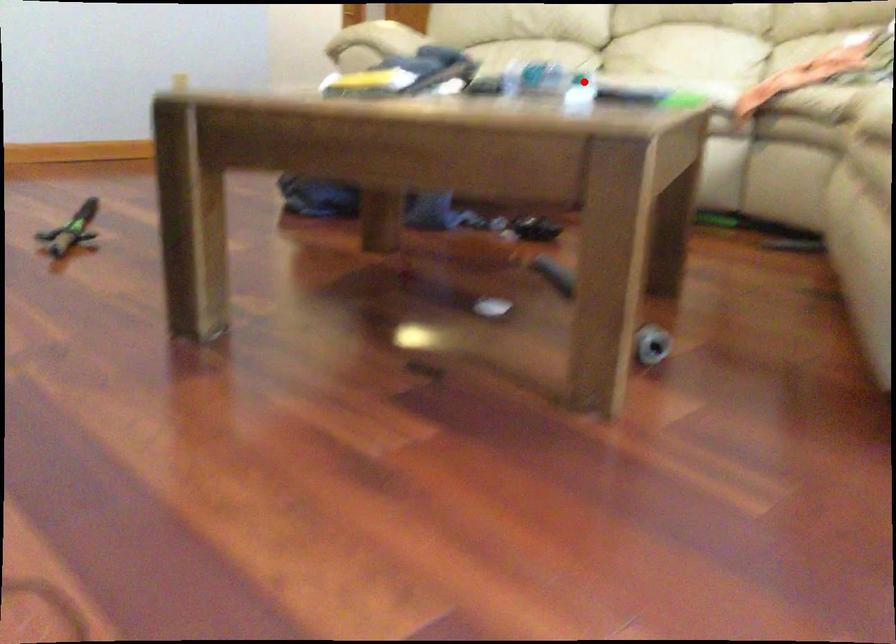
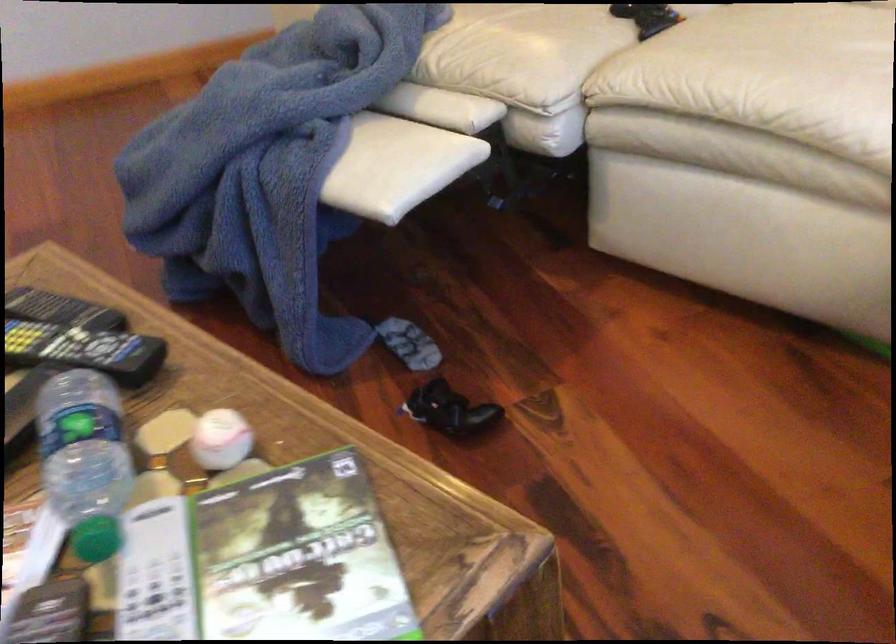
Question: A red point is marked in image1. In image2, is the corresponding 3D point closer to the camera or farther? Reply with the corresponding letter.

Choices:
 (A) The corresponding 3D point is closer.
 (B) The corresponding 3D point is farther.

Answer: (A)